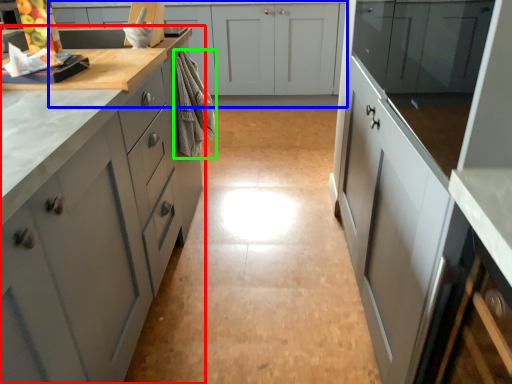
Question: Considering the real-world distances, which object is farthest from cabinetry (highlighted by a red box)? cabinetry (highlighted by a blue box) or material (highlighted by a green box)?

Choices:
 (A) cabinetry
 (B) material

Answer: (A)